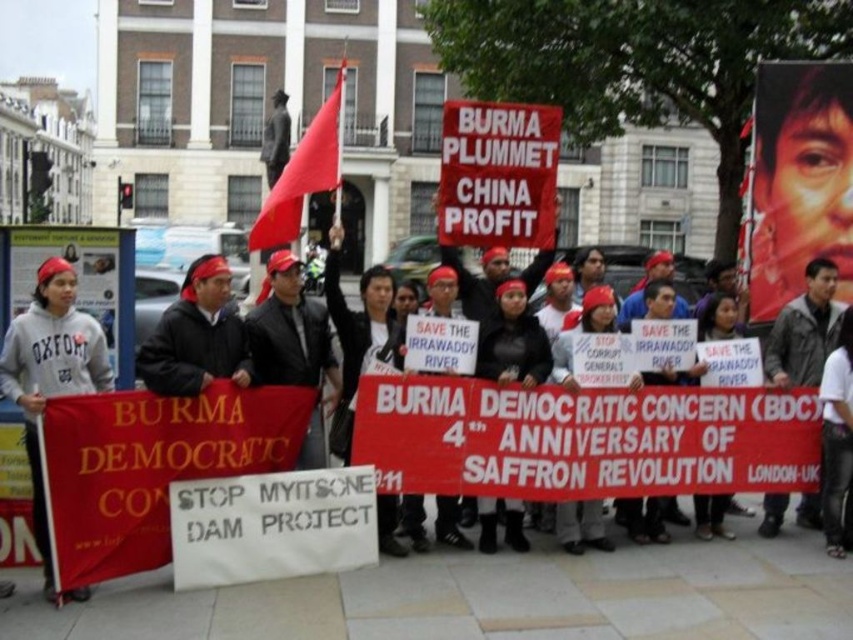
Is black fabric at center closer to camera compared to red fabric flag at upper center?

Yes, it is.

Is point (519, 332) in front of point (329, 97)?

That is True.

Where is `black fabric at center`? The width and height of the screenshot is (853, 640). black fabric at center is located at coordinates (512, 340).

What do you see at coordinates (289, 330) in the screenshot? I see `matte black jacket at center` at bounding box center [289, 330].

Measure the distance between matte black jacket at center and dark brown leather jacket at center.

33.16 meters

Between point (297, 326) and point (279, 141), which one is positioned in front?

Positioned in front is point (297, 326).

Where is `matte black jacket at center`? The height and width of the screenshot is (640, 853). matte black jacket at center is located at coordinates [289, 330].

Can you confirm if dark gray leather jacket at center is positioned above black fabric at center?

Yes.

Looking at this image, who is shorter, dark gray leather jacket at center or black fabric at center?

With less height is black fabric at center.

Is point (819, 282) positioned in front of point (496, 346)?

No, (819, 282) is further to viewer.

Locate an element on the screen. The height and width of the screenshot is (640, 853). dark gray leather jacket at center is located at coordinates (804, 330).